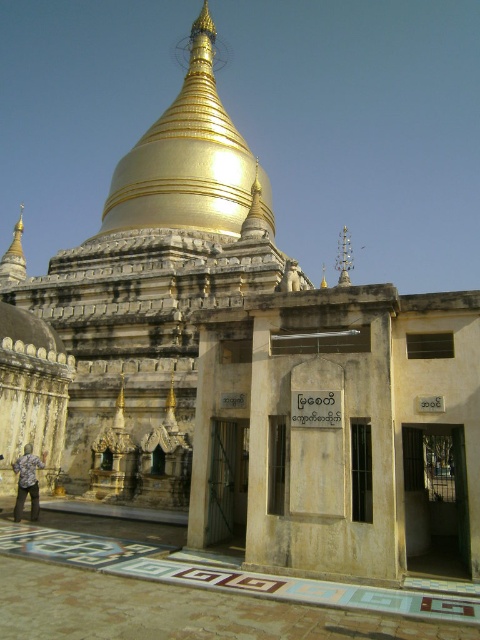
Does gold polished dome at center appear on the left side of printed cotton shirt at lower left?

No, gold polished dome at center is not to the left of printed cotton shirt at lower left.

Does gold polished dome at center appear on the right side of printed cotton shirt at lower left?

Indeed, gold polished dome at center is positioned on the right side of printed cotton shirt at lower left.

This screenshot has height=640, width=480. Identify the location of gold polished dome at center. (188, 161).

This screenshot has width=480, height=640. In order to click on gold polished dome at center in this screenshot , I will do `click(188, 161)`.